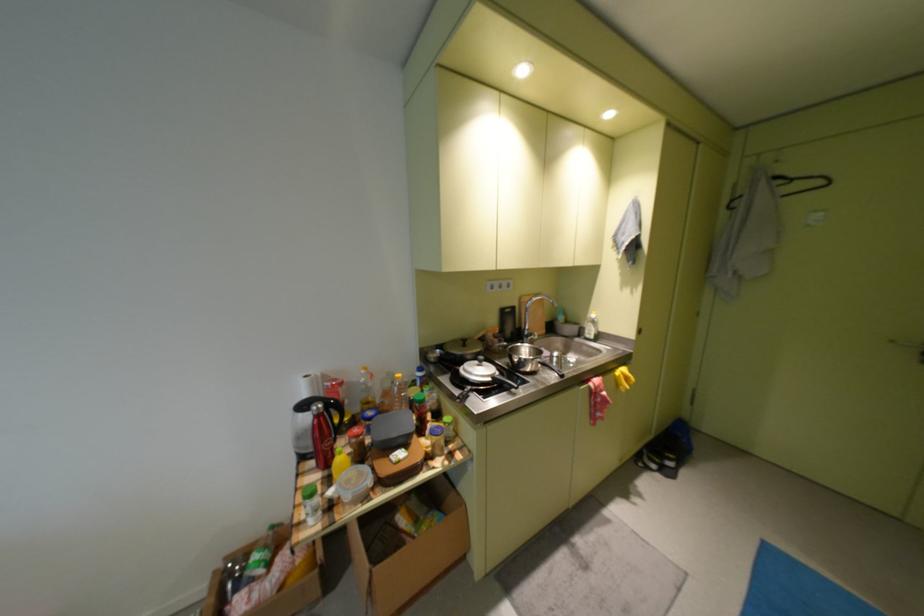
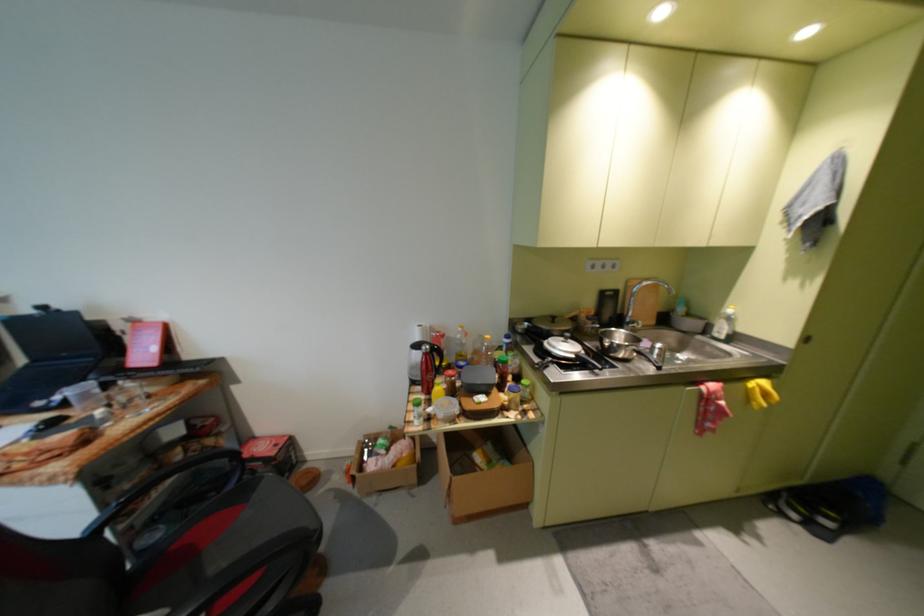
Where in the second image is the point corresponding to (334,479) from the first image?

(435, 400)